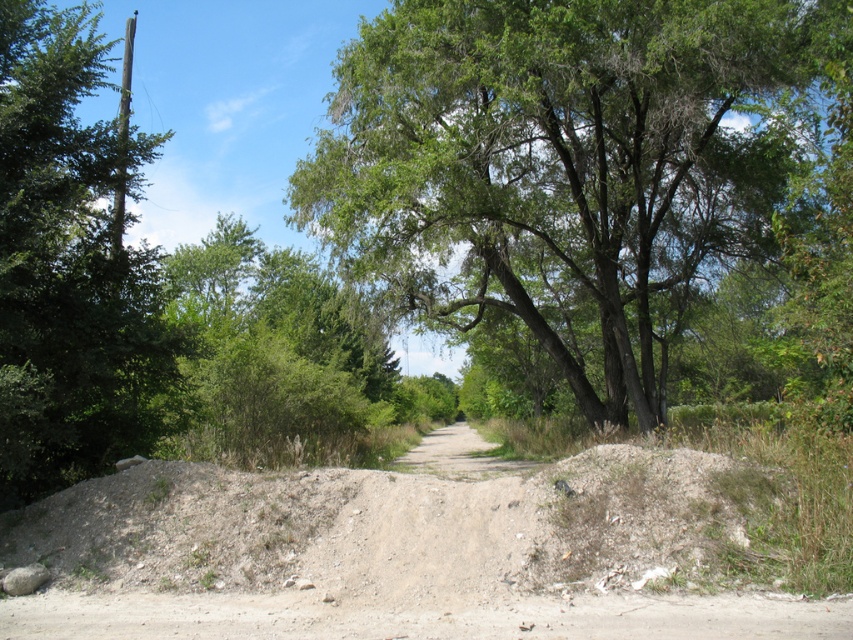
Is green leafy tree at center smaller than brown sandy dirt at center?

No, green leafy tree at center is not smaller than brown sandy dirt at center.

Between green leafy tree at center and brown sandy dirt at center, which one has less height?

brown sandy dirt at center

Identify the location of green leafy tree at center. The image size is (853, 640). (585, 168).

Can you confirm if green leafy tree at center is positioned below dirt/gravel path at center?

Actually, green leafy tree at center is above dirt/gravel path at center.

From the picture: Measure the distance between green leafy tree at center and dirt/gravel path at center.

green leafy tree at center and dirt/gravel path at center are 6.37 meters apart.

Is point (608, 365) closer to camera compared to point (460, 445)?

Yes, it is in front of point (460, 445).

Find the location of a particular element. This screenshot has width=853, height=640. green leafy tree at center is located at coordinates (585, 168).

The height and width of the screenshot is (640, 853). What do you see at coordinates (395, 554) in the screenshot?
I see `brown sandy dirt at center` at bounding box center [395, 554].

Describe the element at coordinates (395, 554) in the screenshot. I see `brown sandy dirt at center` at that location.

I want to click on brown sandy dirt at center, so click(395, 554).